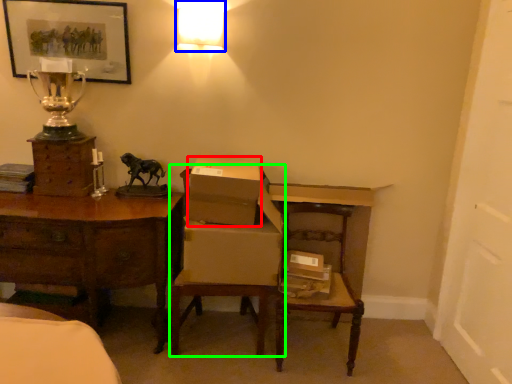
Question: Which object is the closest to the cardboard box (highlighted by a red box)? Choose among these: lamp (highlighted by a blue box) or armchair (highlighted by a green box).

Choices:
 (A) lamp
 (B) armchair

Answer: (B)